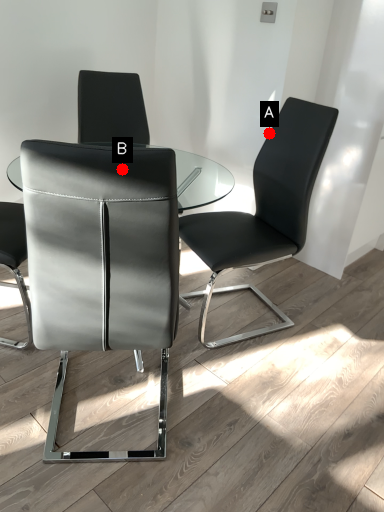
Question: Two points are circled on the image, labeled by A and B beside each circle. Which of the following is the farthest from the observer?

Choices:
 (A) A is further
 (B) B is further

Answer: (A)